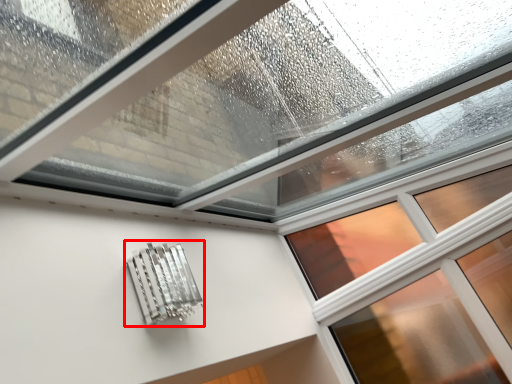
Question: From the image, what is the correct spatial relationship of metal (annotated by the red box) in relation to window?

Choices:
 (A) left
 (B) right

Answer: (A)